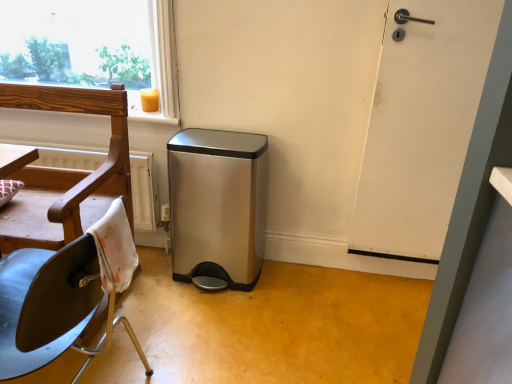
Question: Does wooden chair at left contain white matte door at right?

Choices:
 (A) no
 (B) yes

Answer: (A)

Question: Is wooden chair at left taller than white matte door at right?

Choices:
 (A) yes
 (B) no

Answer: (B)

Question: Is wooden chair at left wider than white matte door at right?

Choices:
 (A) no
 (B) yes

Answer: (B)

Question: From a real-world perspective, is wooden chair at left positioned over white matte door at right based on gravity?

Choices:
 (A) yes
 (B) no

Answer: (B)

Question: Does wooden chair at left lie behind white matte door at right?

Choices:
 (A) yes
 (B) no

Answer: (B)

Question: Considering the relative sizes of wooden chair at left and white matte door at right in the image provided, is wooden chair at left bigger than white matte door at right?

Choices:
 (A) yes
 (B) no

Answer: (A)

Question: Does wooden chair at left appear on the right side of satin steel trash can at center?

Choices:
 (A) no
 (B) yes

Answer: (A)

Question: From the image's perspective, is wooden chair at left on top of satin steel trash can at center?

Choices:
 (A) no
 (B) yes

Answer: (B)

Question: Are wooden chair at left and satin steel trash can at center making contact?

Choices:
 (A) yes
 (B) no

Answer: (B)

Question: Considering the relative sizes of wooden chair at left and satin steel trash can at center in the image provided, is wooden chair at left smaller than satin steel trash can at center?

Choices:
 (A) no
 (B) yes

Answer: (A)

Question: Is wooden chair at left facing away from satin steel trash can at center?

Choices:
 (A) yes
 (B) no

Answer: (B)

Question: Does wooden chair at left have a lesser height compared to satin steel trash can at center?

Choices:
 (A) no
 (B) yes

Answer: (A)

Question: Is the depth of satin steel trash can at center less than that of white matte door at right?

Choices:
 (A) yes
 (B) no

Answer: (B)